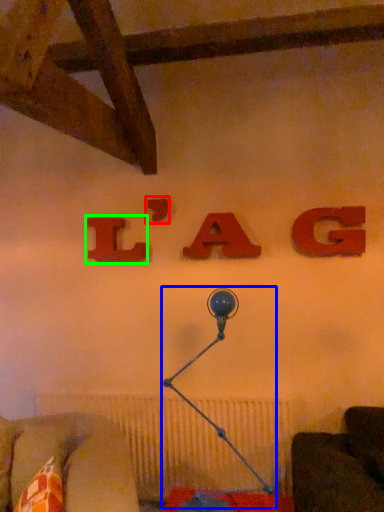
Question: Which object is positioned closest to alphabet (highlighted by a red box)? Select from table lamp (highlighted by a blue box) and alphabet (highlighted by a green box).

Choices:
 (A) table lamp
 (B) alphabet

Answer: (B)